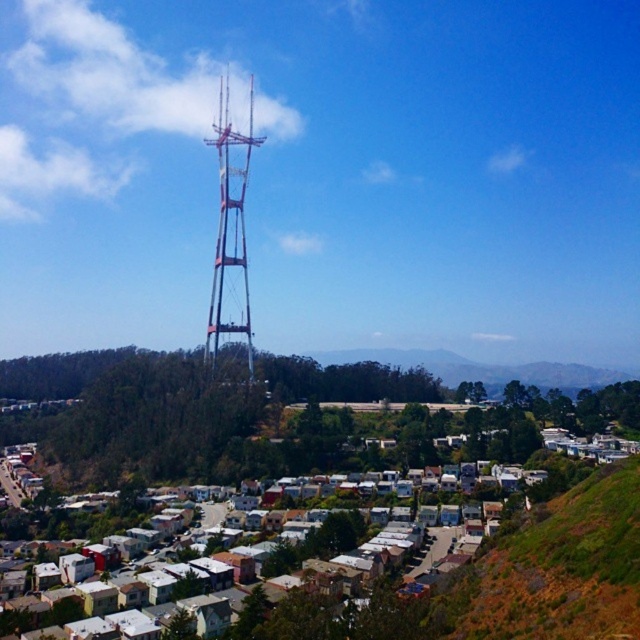
Is green grassy hillside at lower right positioned before metallic silver tower at center?

Yes, green grassy hillside at lower right is in front of metallic silver tower at center.

Does green grassy hillside at lower right have a greater width compared to metallic silver tower at center?

Yes.

Who is more distant from viewer, (632, 524) or (250, 150)?

Point (250, 150)

Identify the location of green grassy hillside at lower right. Image resolution: width=640 pixels, height=640 pixels. (556, 568).